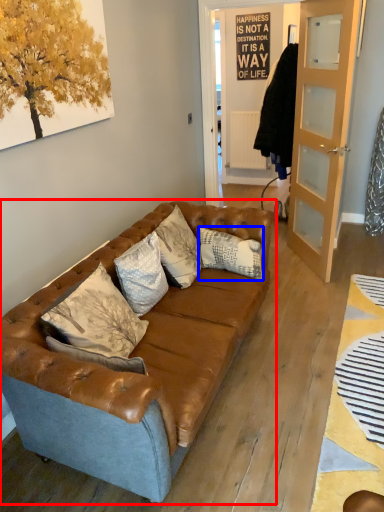
Question: Among these objects, which one is nearest to the camera, studio couch (highlighted by a red box) or pillow (highlighted by a blue box)?

Choices:
 (A) studio couch
 (B) pillow

Answer: (A)